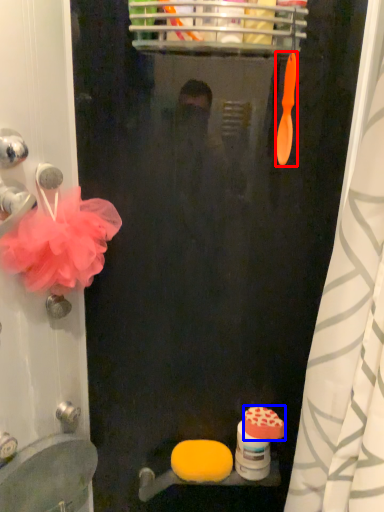
Question: Among these objects, which one is nearest to the camera, brush (highlighted by a red box) or soap (highlighted by a blue box)?

Choices:
 (A) brush
 (B) soap

Answer: (A)